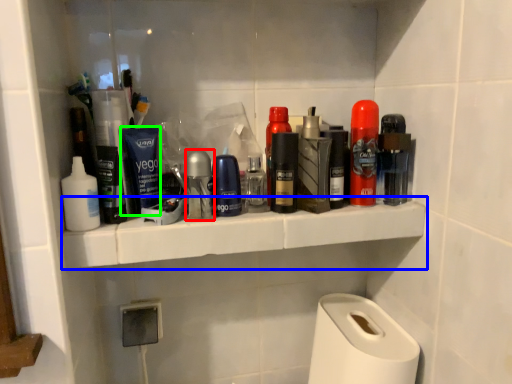
Question: Which object is the closest to the toiletry (highlighted by a red box)? Choose among these: ledge (highlighted by a blue box) or personal care (highlighted by a green box).

Choices:
 (A) ledge
 (B) personal care

Answer: (B)